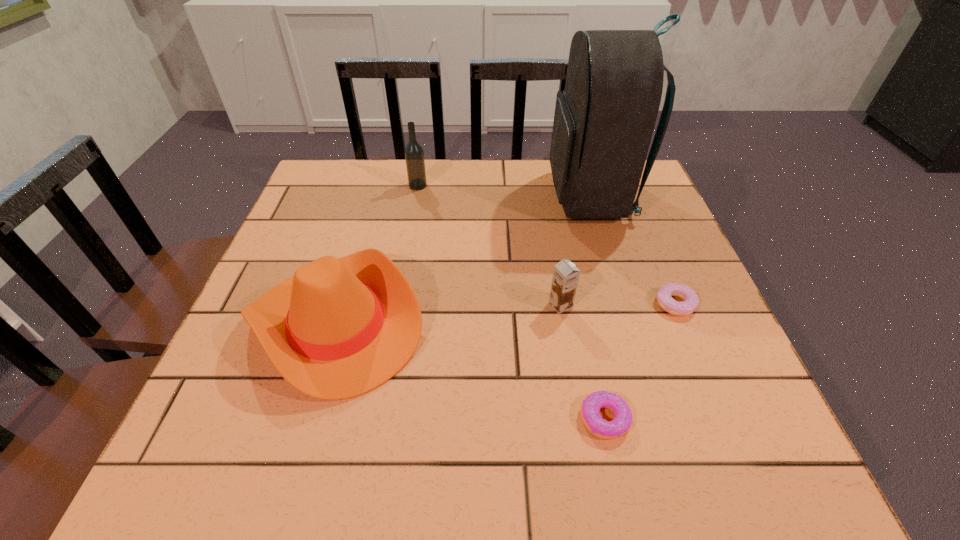
At what (x,y) coordinates should I click in order to perform the action: click on vacant area between the farther doughnut and the fourth shortest object. Please return your answer as a coordinate pair (x, y). The image size is (960, 540). Looking at the image, I should click on (506, 314).

Locate an element on the screen. This screenshot has height=540, width=960. vacant space that's between the chocolate milk and the cowboy hat is located at coordinates (448, 314).

Where is `unoccupied position between the fifth shortest object and the tallest object`? This screenshot has height=540, width=960. unoccupied position between the fifth shortest object and the tallest object is located at coordinates (504, 191).

Find the location of a particular element. vacant point located between the right doughnut and the fifth shortest object is located at coordinates (546, 245).

Locate an element on the screen. The height and width of the screenshot is (540, 960). vacant area that lies between the nearer doughnut and the fourth tallest object is located at coordinates (583, 362).

Where is `unoccupied area between the tallest object and the cowboy hat`? The image size is (960, 540). unoccupied area between the tallest object and the cowboy hat is located at coordinates (464, 260).

Find the location of a particular element. This screenshot has width=960, height=540. free spot between the tallest object and the cowboy hat is located at coordinates (x=464, y=260).

Find the location of a particular element. The image size is (960, 540). object that can be found as the second closest to the farther doughnut is located at coordinates (604, 119).

Choose which object is the nearest neighbor to the backpack. Please provide its 2D coordinates. Your answer should be formatted as a tuple, i.e. [(x, y)], where the tuple contains the x and y coordinates of a point satisfying the conditions above.

[(690, 304)]

This screenshot has width=960, height=540. In order to click on free space that satisfies the following two spatial constraints: 1. on the back side of the right doughnut; 2. on the front-facing side of the backpack in this screenshot , I will do `click(631, 197)`.